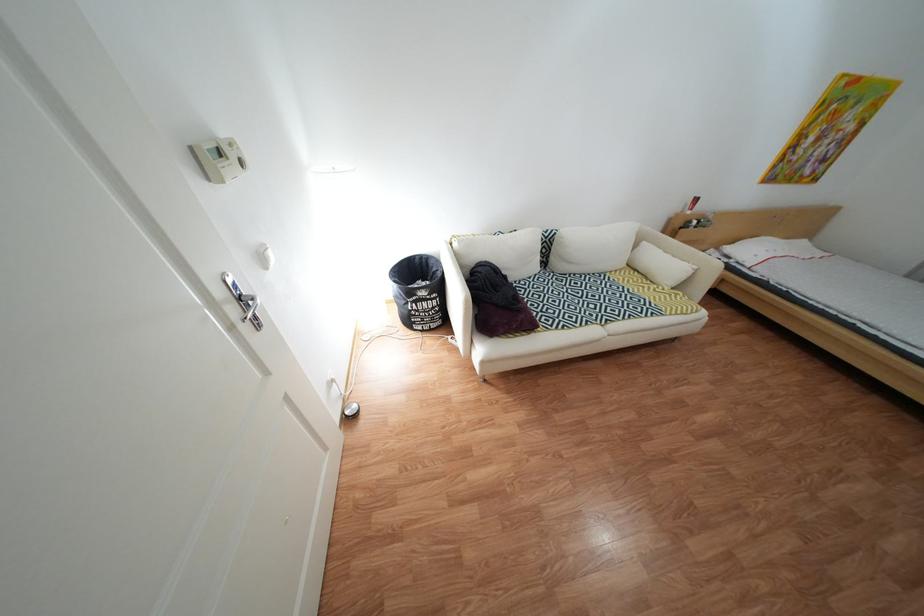
Find where to press the floor lamp switch. Please return your answer as a coordinate pair (x, y).

(350, 411)